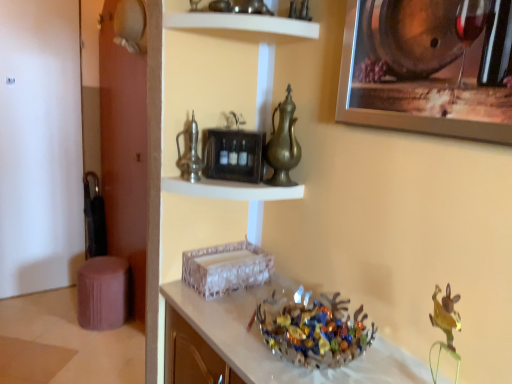
At what (x,y) coordinates should I click in order to perform the action: click on free space to the left of purple fabric stool at lower left. Please return your answer as a coordinate pair (x, y). The width and height of the screenshot is (512, 384). Looking at the image, I should click on (53, 320).